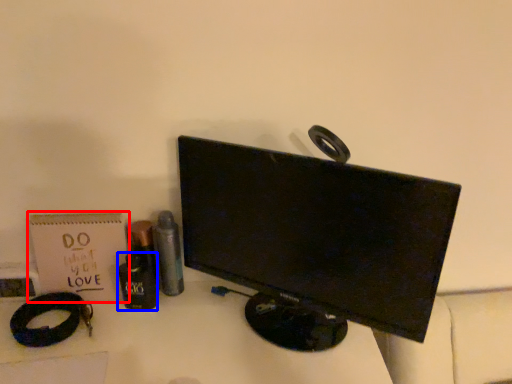
Question: Among these objects, which one is farthest to the camera, paperback book (highlighted by a red box) or toiletry (highlighted by a blue box)?

Choices:
 (A) paperback book
 (B) toiletry

Answer: (A)